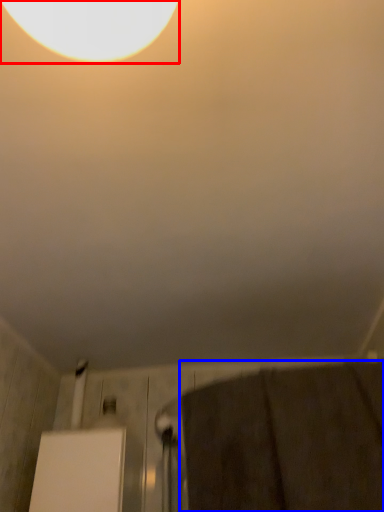
Question: Which object is further to the camera taking this photo, lamp (highlighted by a red box) or bath towel (highlighted by a blue box)?

Choices:
 (A) lamp
 (B) bath towel

Answer: (B)